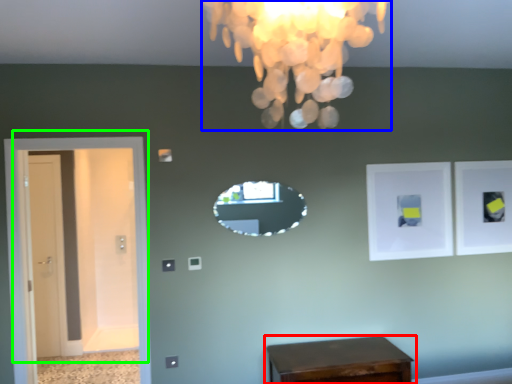
Question: Which object is the farthest from table (highlighted by a red box)? Choose among these: lamp (highlighted by a blue box) or door (highlighted by a green box).

Choices:
 (A) lamp
 (B) door

Answer: (A)